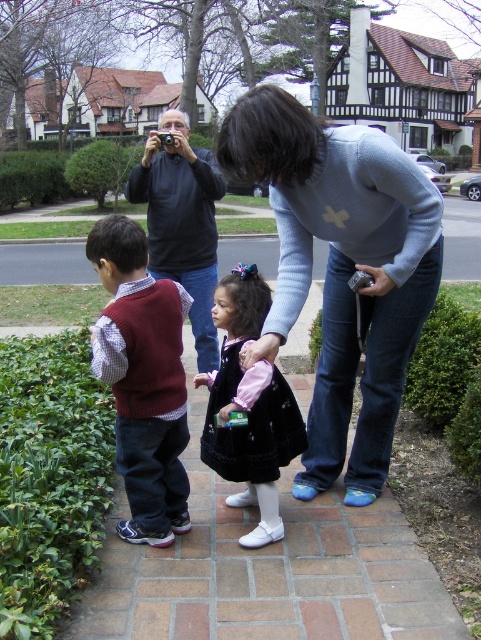
You are a photographer standing on the paved brick pathway. You want to take a photo of the light blue sweater at center and the maroon sweater at left. The camera you have can focus on objects within 25 inches. Can you capture both in focus without moving?

The light blue sweater at center is 28.69 inches from the maroon sweater at left, which is beyond the camera focus range of 25 inches. Therefore, you cannot capture both in focus without moving.

You are a clothing designer observing the scene. You need to recommend a size for a new customer who is similar in build to the person wearing the light blue sweater at center and the maroon sweater at left. Which sweater would you suggest a larger size for?

The light blue sweater at center has a larger size compared to the maroon sweater at left, so you should recommend a larger size for the light blue sweater at center.

You are a photographer trying to capture a candid shot. You notice the dark blue velvet dress at center and the dark gray sweater at upper left in your viewfinder. Which clothing item will appear larger in your photo?

The dark blue velvet dress at center will appear larger in the photo because it is closer to the viewer than the dark gray sweater at upper left.